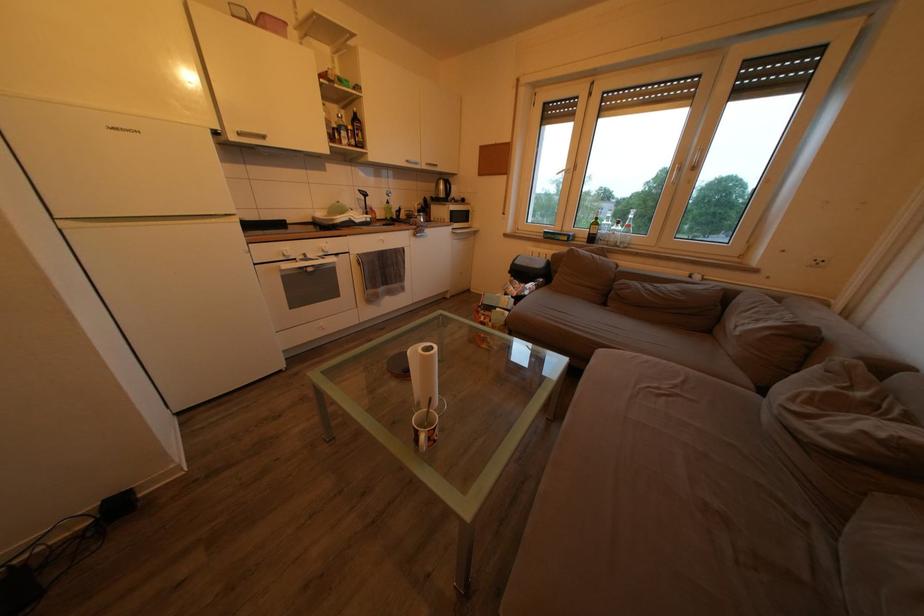
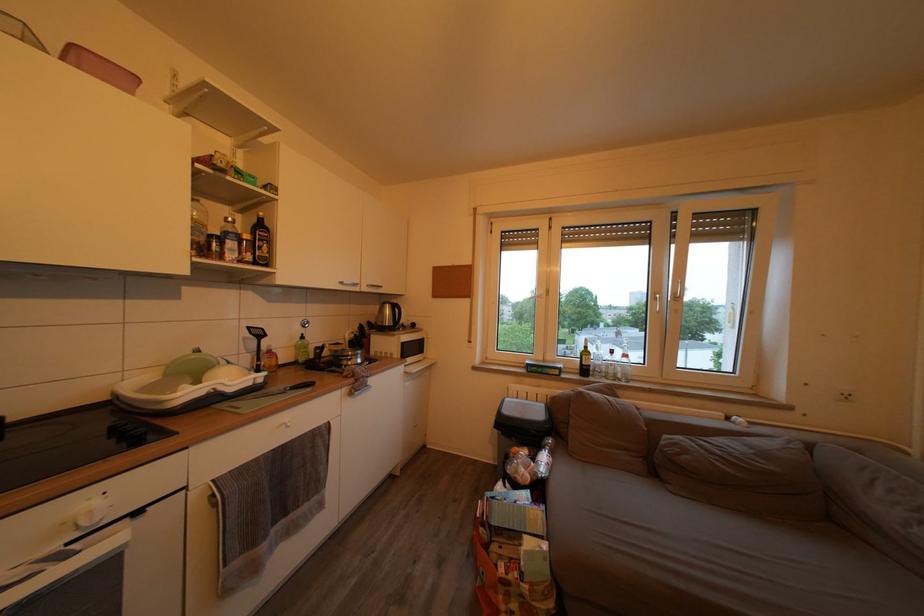
In the second image, find the point that corresponds to the point at 613,238 in the first image.

(608, 369)